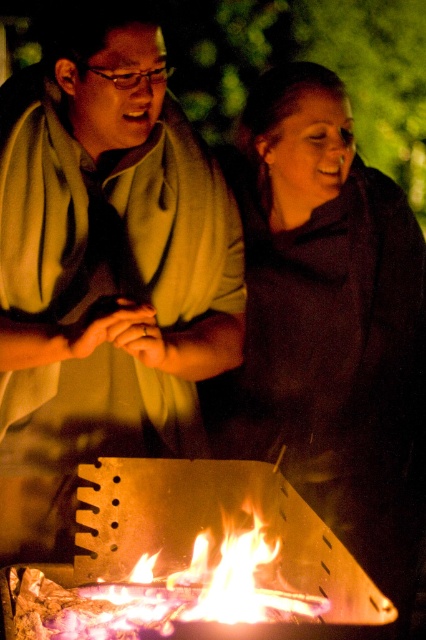
Who is higher up, matte green scarf at center or black matte apron at center?

matte green scarf at center is above.

Can you confirm if matte green scarf at center is positioned below black matte apron at center?

Incorrect, matte green scarf at center is not positioned below black matte apron at center.

Identify the location of matte green scarf at center. This screenshot has height=640, width=426. (103, 269).

Looking at this image, is black matte apron at center positioned behind flaming wood at center?

Yes.

Is point (371, 444) closer to viewer compared to point (131, 637)?

No, it is behind (131, 637).

You are a GUI agent. You are given a task and a screenshot of the screen. Output one action in this format:
    pyautogui.click(x=<x>, y=<y>)
    Task: Click on the black matte apron at center
    Image resolution: width=426 pixels, height=640 pixels.
    Given the screenshot: What is the action you would take?
    pyautogui.click(x=328, y=324)

Between matte green scarf at center and flaming wood at center, which one is positioned higher?

Positioned higher is matte green scarf at center.

Which is behind, point (11, 145) or point (218, 630)?

Point (11, 145)

Based on the photo, measure the distance between point (6,317) and camera.

Point (6,317) is 5.91 feet from camera.

The width and height of the screenshot is (426, 640). Identify the location of matte green scarf at center. (103, 269).